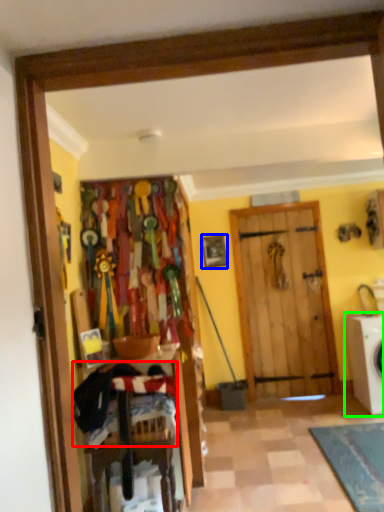
Question: Based on their relative distances, which object is farther from laundry (highlighted by a red box)? Choose from picture frame (highlighted by a blue box) and washing machine (highlighted by a green box).

Choices:
 (A) picture frame
 (B) washing machine

Answer: (A)